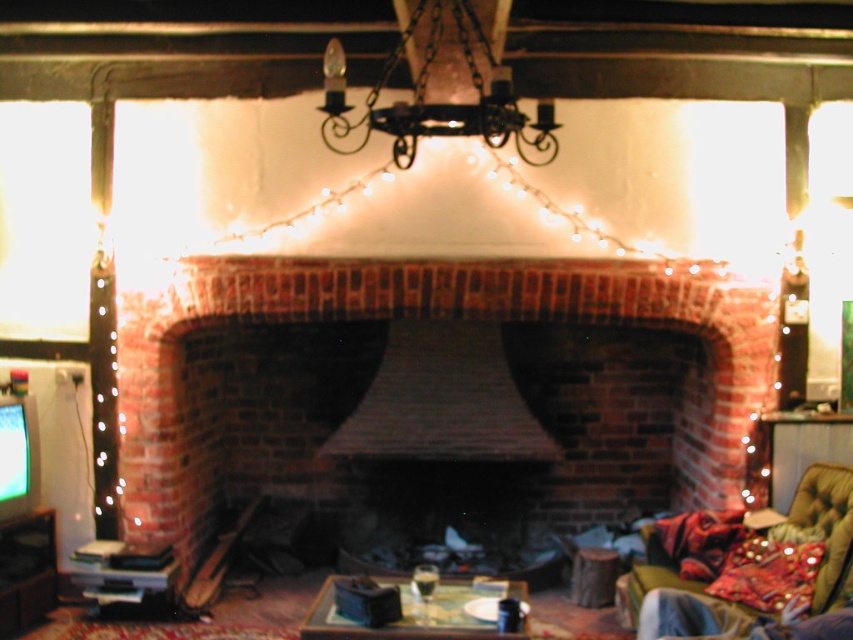
Question: Which of these objects is positioned farthest from the matte black television at left?

Choices:
 (A) matte glass tray at center
 (B) brick fireplace at center
 (C) velvet green couch at lower right
 (D) black wrought iron chandelier at upper center

Answer: (C)

Question: Does brick fireplace at center lie behind matte black television at left?

Choices:
 (A) no
 (B) yes

Answer: (B)

Question: Which point is farther from the camera taking this photo?

Choices:
 (A) (471, 272)
 (B) (834, 566)
 (C) (413, 8)
 (D) (316, 624)

Answer: (A)

Question: Does brick fireplace at center appear on the right side of black wrought iron chandelier at upper center?

Choices:
 (A) no
 (B) yes

Answer: (B)

Question: Is brick fireplace at center below matte glass tray at center?

Choices:
 (A) yes
 (B) no

Answer: (B)

Question: Among these points, which one is nearest to the camera?

Choices:
 (A) (665, 582)
 (B) (219, 333)
 (C) (22, 515)
 (D) (402, 589)

Answer: (D)